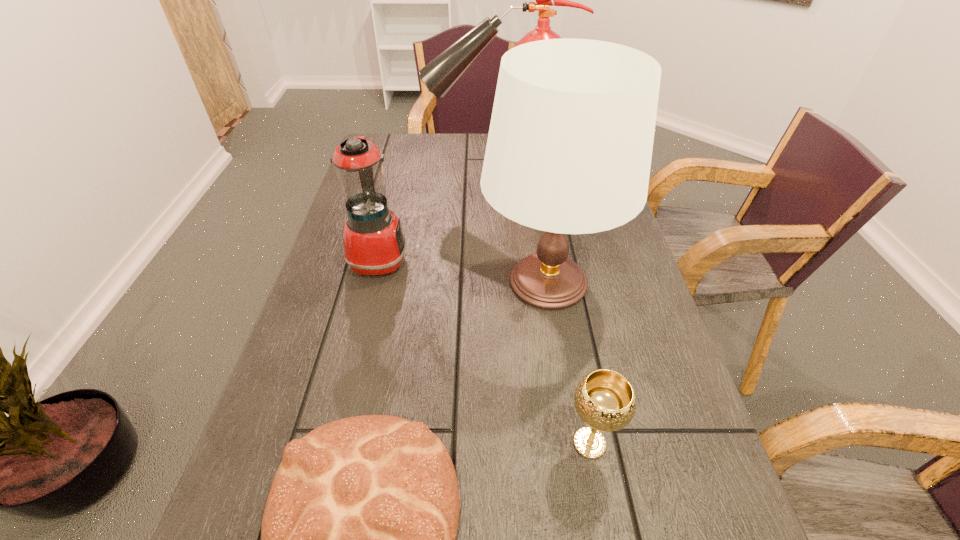
Locate an element on the screen. The width and height of the screenshot is (960, 540). object that is positioned at the far edge is located at coordinates (439, 75).

The image size is (960, 540). In order to click on object that is at the left edge in this screenshot , I will do `click(374, 244)`.

At what (x,y) coordinates should I click in order to perform the action: click on fire extinguisher that is at the right edge. Please return your answer as a coordinate pair (x, y). The height and width of the screenshot is (540, 960). Looking at the image, I should click on (439, 75).

At what (x,y) coordinates should I click in order to perform the action: click on lamp that is at the right edge. Please return your answer as a coordinate pair (x, y). Image resolution: width=960 pixels, height=540 pixels. Looking at the image, I should click on 569,149.

Where is `chalice positioned at the right edge`? chalice positioned at the right edge is located at coordinates (605, 400).

Where is `object present at the far right corner`? object present at the far right corner is located at coordinates (439, 75).

Find the location of a particular element. The height and width of the screenshot is (540, 960). vacant space at the far edge of the desktop is located at coordinates (432, 150).

Identify the location of vacant point at the left edge. (339, 289).

At what (x,y) coordinates should I click in order to perform the action: click on free space at the right edge of the desktop. Please return your answer as a coordinate pair (x, y). The width and height of the screenshot is (960, 540). Looking at the image, I should click on (610, 340).

Where is `vacant area that lies between the farthest object and the third tallest object`? vacant area that lies between the farthest object and the third tallest object is located at coordinates (439, 219).